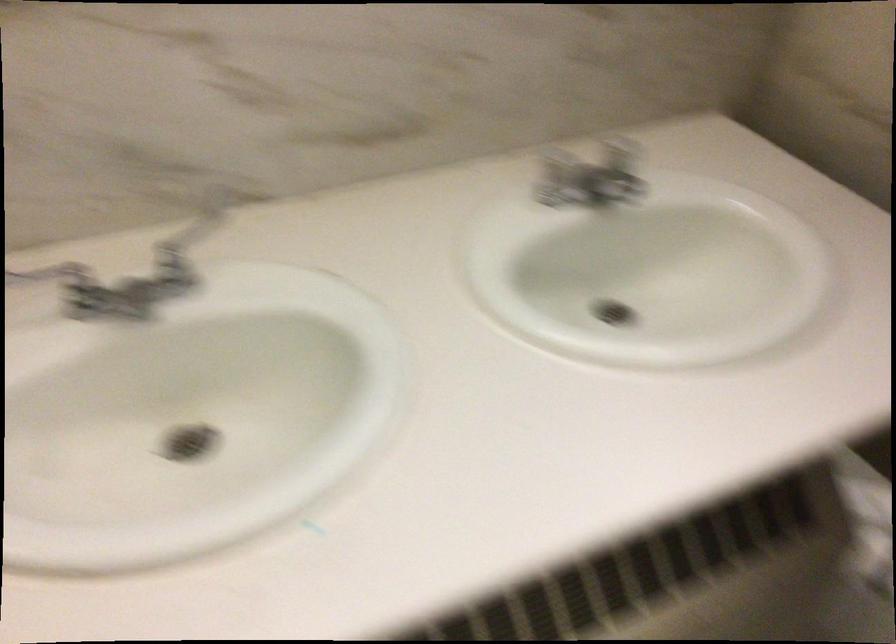
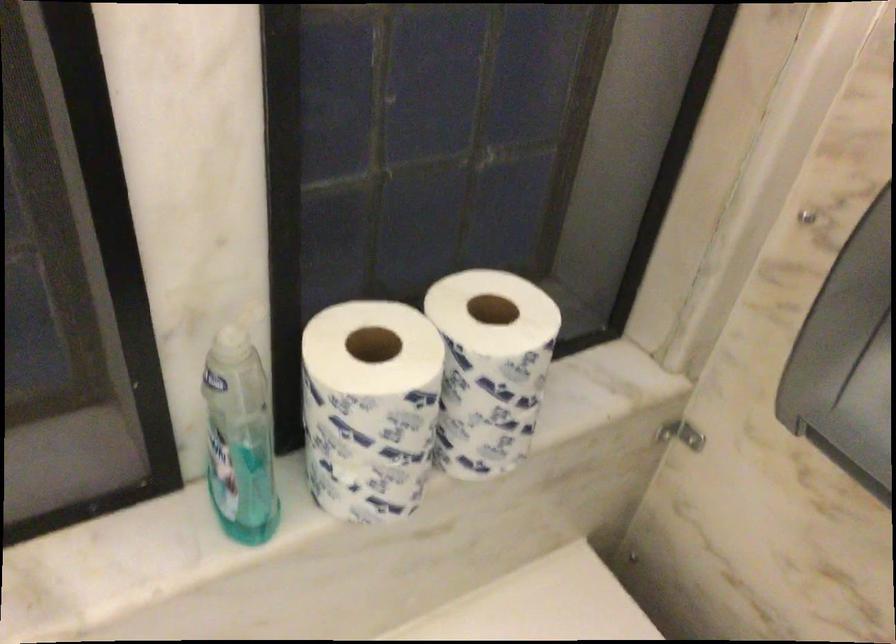
Looking at this image, which direction would the cameraman need to move to produce the second image?

The movement direction of the cameraman is right, forward.